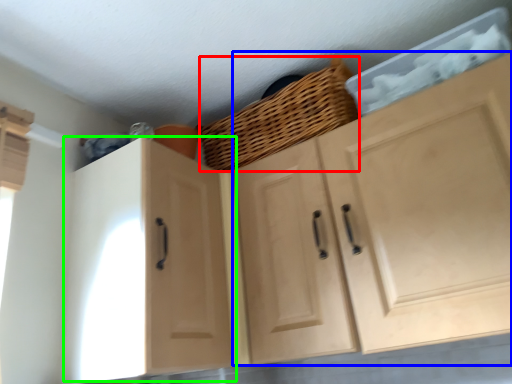
Question: Which object is the farthest from basket (highlighted by a red box)? Choose among these: cabinetry (highlighted by a blue box) or cabinetry (highlighted by a green box).

Choices:
 (A) cabinetry
 (B) cabinetry

Answer: (B)